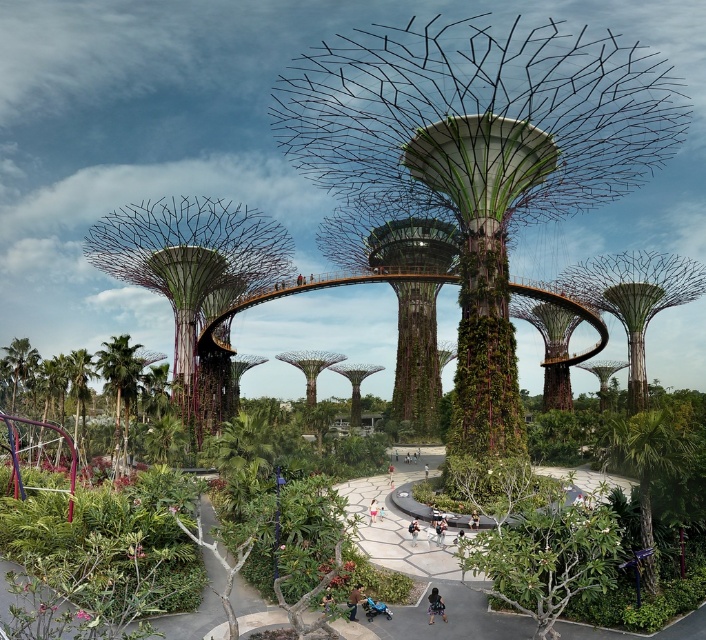
Does light blue denim shorts at lower center appear over brown leather jacket at lower center?

No, light blue denim shorts at lower center is not above brown leather jacket at lower center.

Consider the image. Does light blue denim shorts at lower center have a greater width compared to brown leather jacket at lower center?

Yes.

Locate an element on the screen. light blue denim shorts at lower center is located at coordinates (436, 605).

From the picture: Does green matte roller coaster at lower left appear under green leafy palm tree at lower left?

Actually, green matte roller coaster at lower left is above green leafy palm tree at lower left.

Who is lower down, green matte roller coaster at lower left or green leafy palm tree at lower left?

green leafy palm tree at lower left

Is point (76, 401) behind point (116, 432)?

Yes, it is.

Find the location of `green matte roller coaster at lower left`. green matte roller coaster at lower left is located at coordinates (71, 381).

Is the position of green matte roller coaster at lower left less distant than that of brown leather jacket at lower center?

No, green matte roller coaster at lower left is behind brown leather jacket at lower center.

Which is above, green matte roller coaster at lower left or brown leather jacket at lower center?

green matte roller coaster at lower left is higher up.

Identify the location of green matte roller coaster at lower left. pyautogui.click(x=71, y=381).

At what (x,y) coordinates should I click in order to perform the action: click on green matte roller coaster at lower left. Please return your answer as a coordinate pair (x, y). The image size is (706, 640). Looking at the image, I should click on (71, 381).